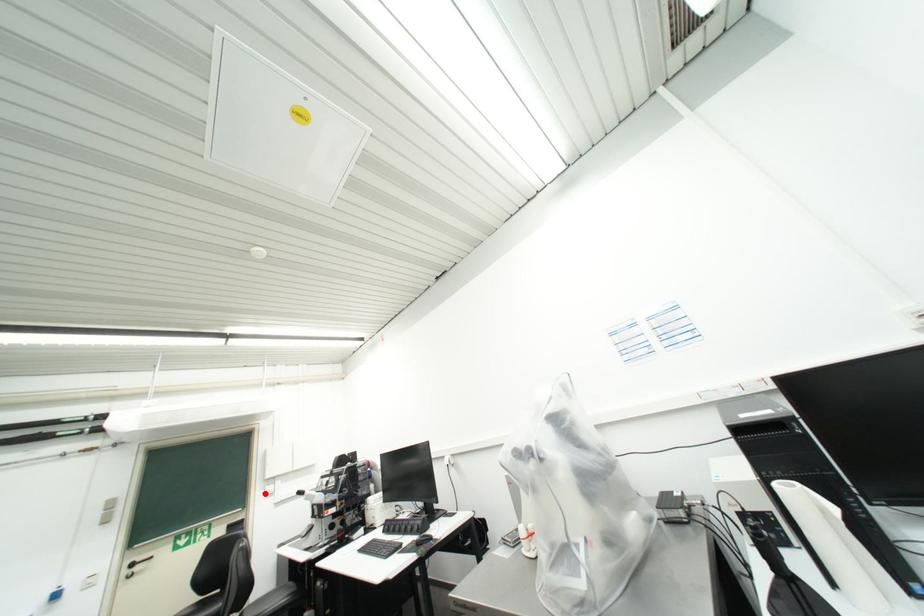
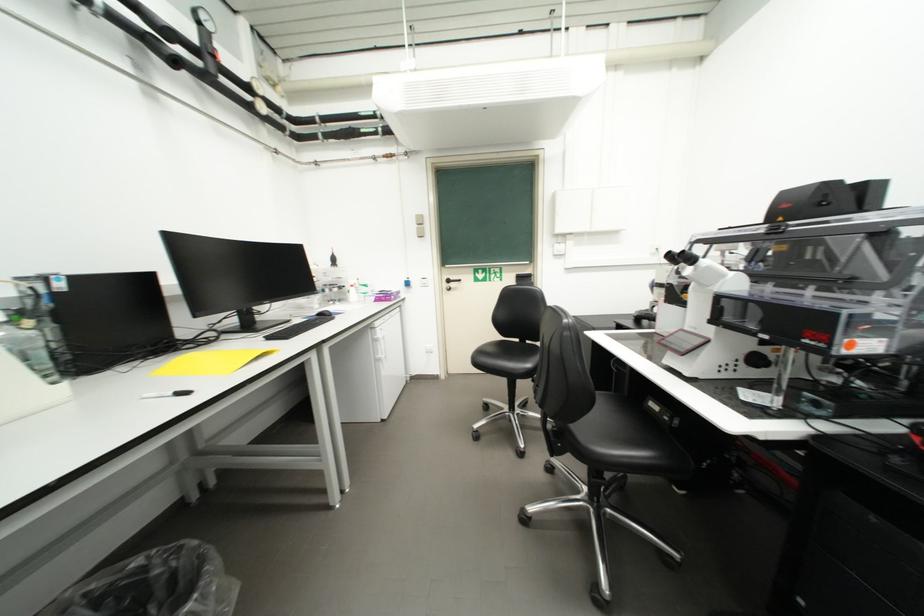
Question: I am providing you with two images of the same scene from different viewpoints. Image1 has a red point marked. In image2, the corresponding 3D location appears at what relative position? Reply with the corresponding letter.

Choices:
 (A) Closer
 (B) Farther

Answer: (A)